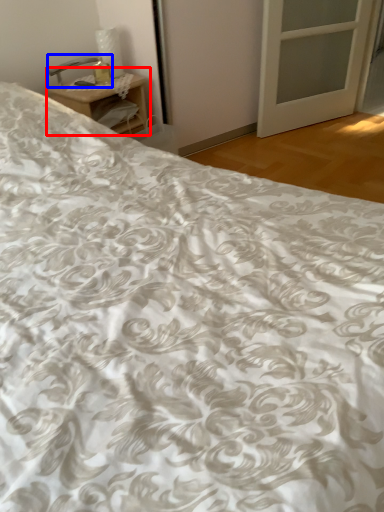
Question: Which object is further to the camera taking this photo, nightstand (highlighted by a red box) or table lamp (highlighted by a blue box)?

Choices:
 (A) nightstand
 (B) table lamp

Answer: (B)